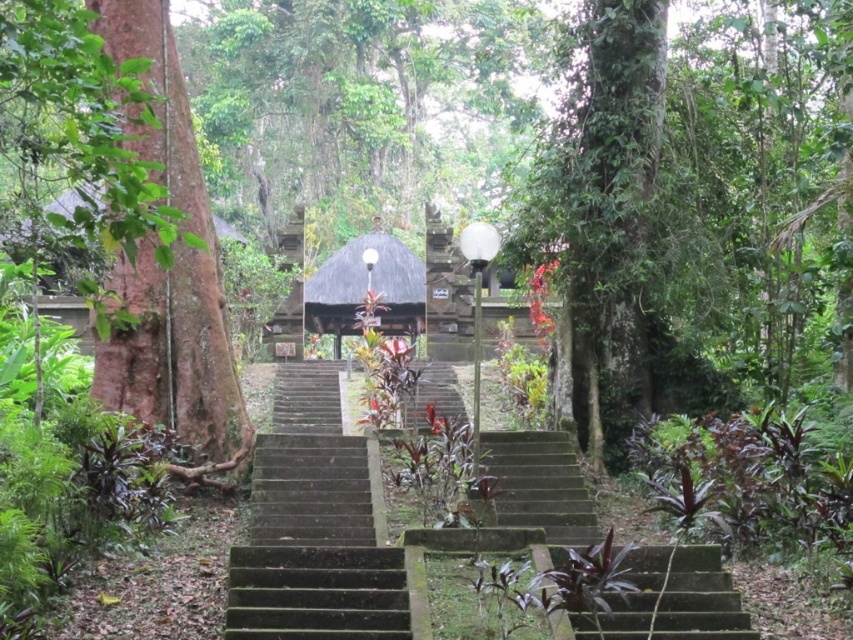
Is green stone stairs at center thinner than green mossy stairs at center?

In fact, green stone stairs at center might be wider than green mossy stairs at center.

Which is behind, point (363, 486) or point (543, 524)?

Point (363, 486)

The image size is (853, 640). I want to click on green stone stairs at center, so click(x=312, y=528).

Which is in front, point (360, 500) or point (341, 282)?

Point (360, 500) is more forward.

Which is more to the left, green stone stairs at center or dark brown thatched hut at center?

dark brown thatched hut at center is more to the left.

The image size is (853, 640). In order to click on green stone stairs at center in this screenshot , I will do `click(312, 528)`.

Does brown rough bark tree at left have a lesser height compared to green stone stairs at center?

In fact, brown rough bark tree at left may be taller than green stone stairs at center.

Can you confirm if brown rough bark tree at left is smaller than green stone stairs at center?

Actually, brown rough bark tree at left might be larger than green stone stairs at center.

Locate an element on the screen. brown rough bark tree at left is located at coordinates (169, 269).

Where is `brown rough bark tree at left`? This screenshot has height=640, width=853. brown rough bark tree at left is located at coordinates (169, 269).